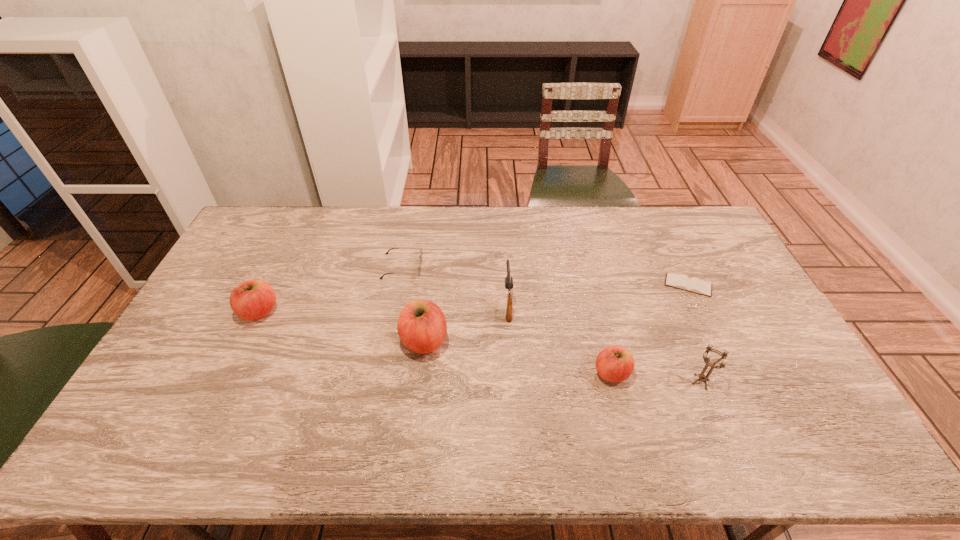
You are a GUI agent. You are given a task and a screenshot of the screen. Output one action in this format:
    pyautogui.click(x=<x>, y=<y>)
    Task: Click on the free space that satisfies the following two spatial constraints: 1. on the front-facing side of the sixth tallest object; 2. on the back side of the second apple from right to left
    Image resolution: width=960 pixels, height=540 pixels.
    Given the screenshot: What is the action you would take?
    pyautogui.click(x=388, y=341)

Where is `free spot that satisfies the following two spatial constraints: 1. on the front-facing side of the candle holder; 2. on the right side of the sixth tallest object`? The image size is (960, 540). free spot that satisfies the following two spatial constraints: 1. on the front-facing side of the candle holder; 2. on the right side of the sixth tallest object is located at coordinates (380, 382).